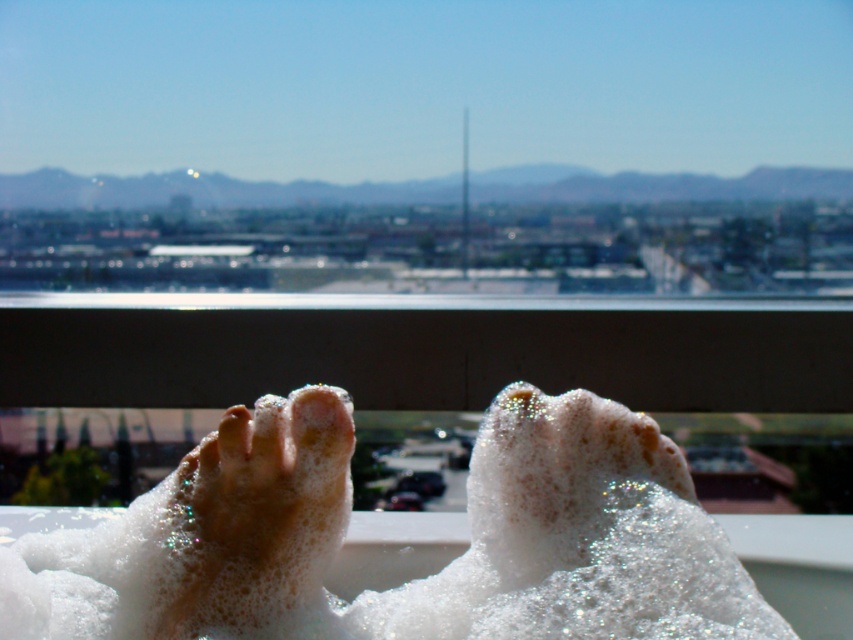
You are a photographer trying to capture the frothy white foot at lower left and the smooth skin toe at center in a single shot. Based on their heights, which object should you focus on first to ensure both are in clear view?

The frothy white foot at lower left has a greater height compared to the smooth skin toe at center, so you should focus on the frothy white foot at lower left first to ensure both are in clear view.

You are a photographer trying to capture the white foamy feet at lower center in the image. The camera is positioned at the origin point of the coordinate system. The point given is in normalized coordinates where the bottom left corner is the origin. Can you determine if the point marked at coordinate point (413, 580) is located on the white foamy feet at lower center?

Yes, the point marked at coordinate point (413, 580) is located on the white foamy feet at lower center as stated in the description.